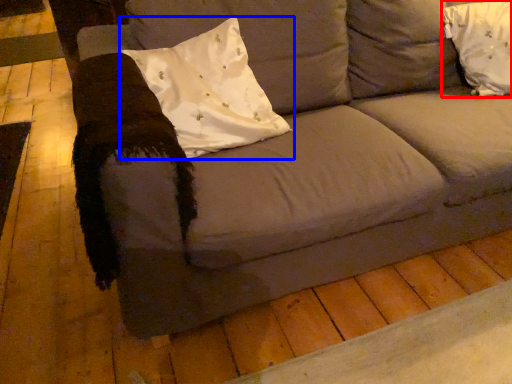
Question: Which object appears farthest to the camera in this image, pillow (highlighted by a red box) or pillow (highlighted by a blue box)?

Choices:
 (A) pillow
 (B) pillow

Answer: (A)